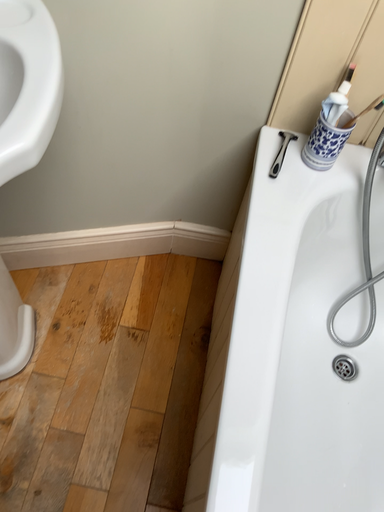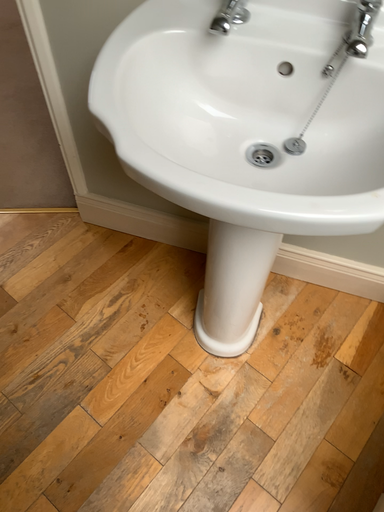
Question: How did the camera likely rotate when shooting the video?

Choices:
 (A) rotated upward
 (B) rotated downward

Answer: (A)